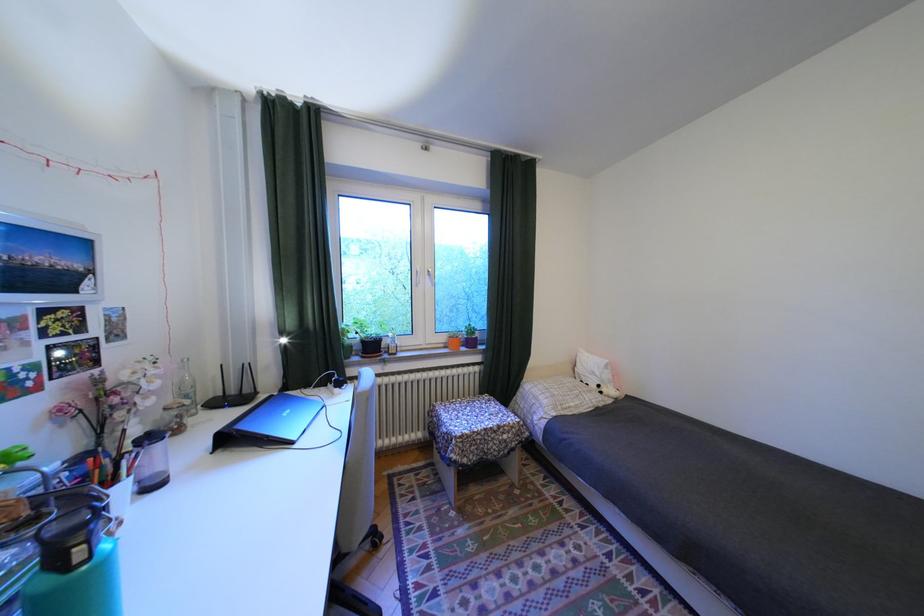
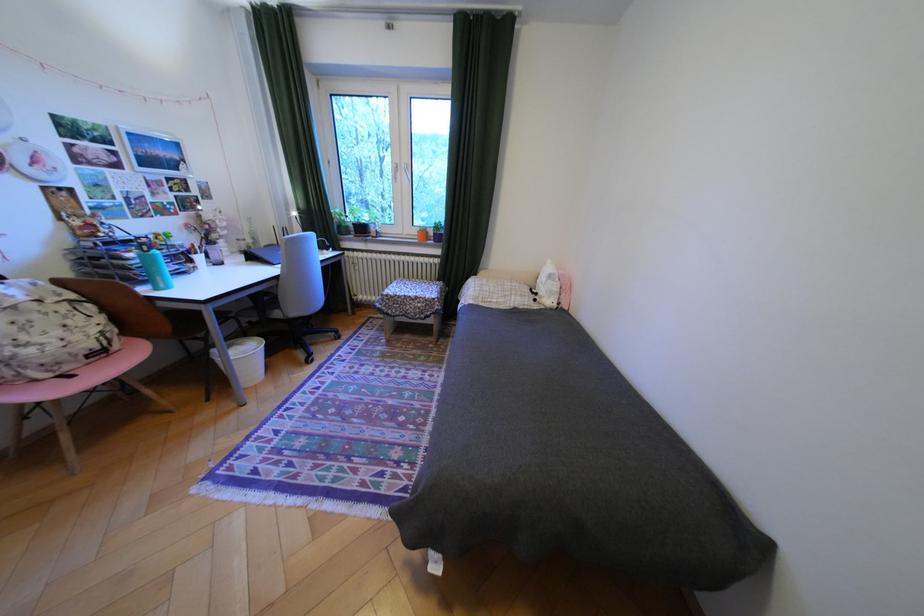
Where in the second image is the point corresponding to (x=611, y=386) from the first image?

(548, 294)